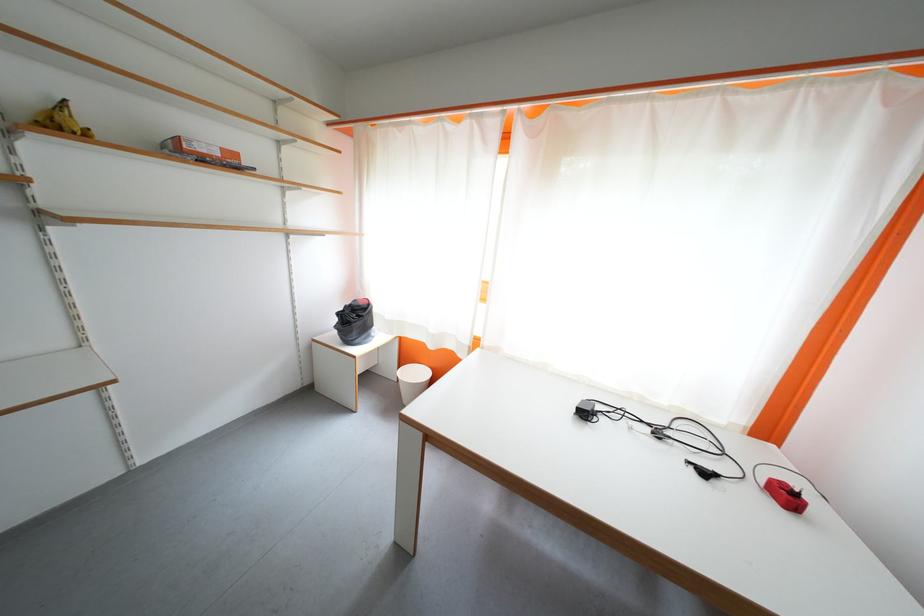
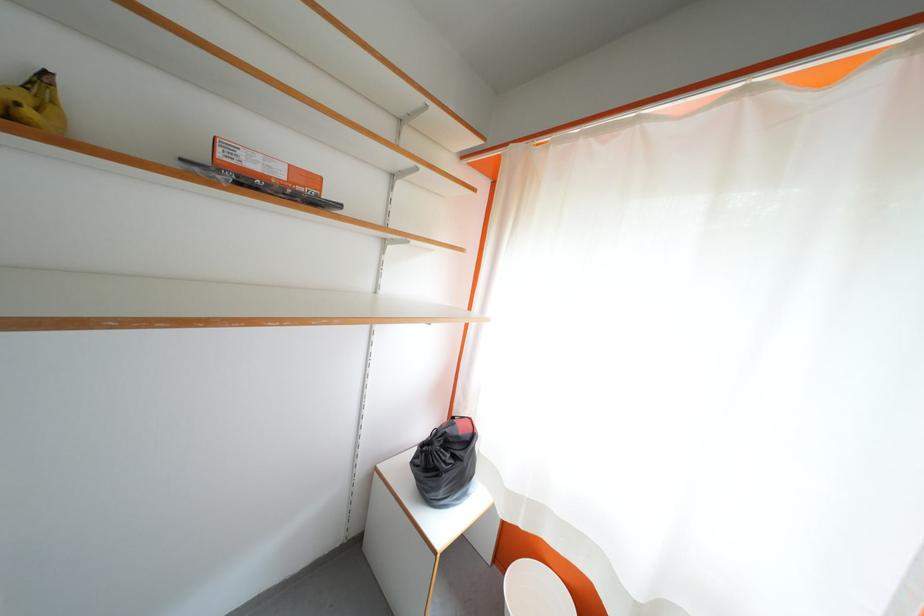
Find the pixel in the second image that matches [362,322] in the first image.

(455, 460)